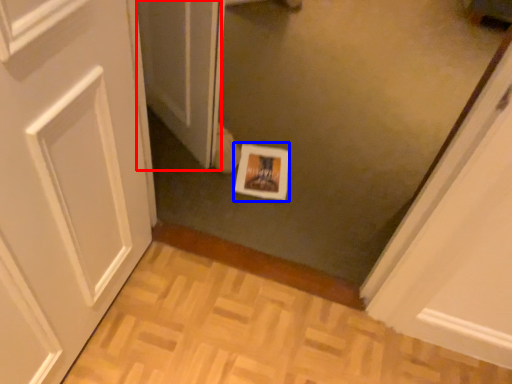
Question: Which object appears farthest to the camera in this image, screen door (highlighted by a red box) or print (highlighted by a blue box)?

Choices:
 (A) screen door
 (B) print

Answer: (B)